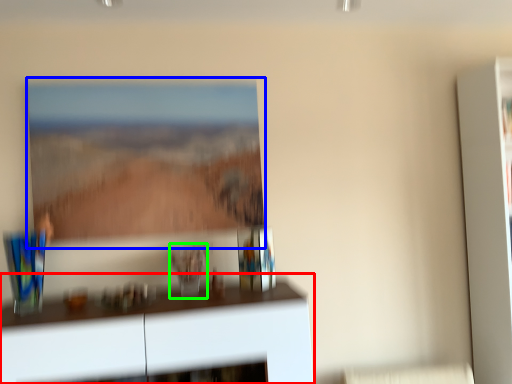
Question: Which object is positioned farthest from furniture (highlighted by a red box)? Select from picture frame (highlighted by a blue box) and glass vase (highlighted by a green box).

Choices:
 (A) picture frame
 (B) glass vase

Answer: (A)